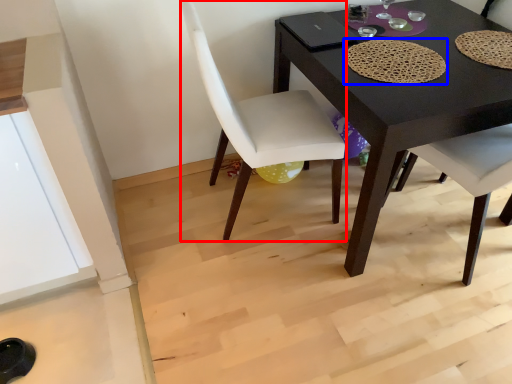
Question: Which point is further to the camera, chair (highlighted by a red box) or mat (highlighted by a blue box)?

Choices:
 (A) chair
 (B) mat

Answer: (B)